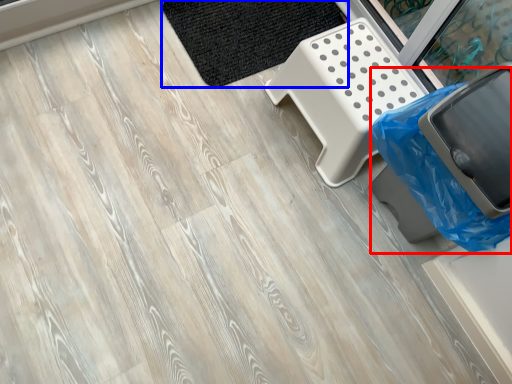
Question: Which point is closer to the camera, garbage (highlighted by a red box) or mat (highlighted by a blue box)?

Choices:
 (A) garbage
 (B) mat

Answer: (A)